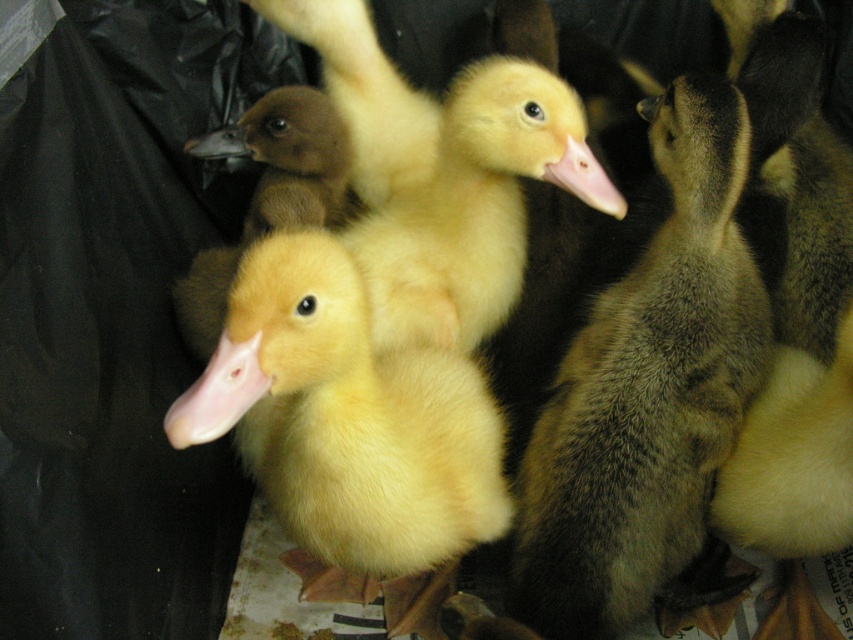
Question: Is soft yellow duckling at center bigger than yellow fluffy duckling at center?

Choices:
 (A) no
 (B) yes

Answer: (A)

Question: Which object appears farthest from the camera in this image?

Choices:
 (A) yellow fluffy duckling at center
 (B) soft yellow duckling at center

Answer: (B)

Question: Can you confirm if soft yellow duckling at center is positioned above yellow fluffy duckling at center?

Choices:
 (A) yes
 (B) no

Answer: (A)

Question: Which of the following is the closest to the observer?

Choices:
 (A) (590, 589)
 (B) (328, 420)

Answer: (B)

Question: Can you confirm if soft yellow duckling at center is positioned to the right of yellow fluffy duckling at center?

Choices:
 (A) no
 (B) yes

Answer: (B)